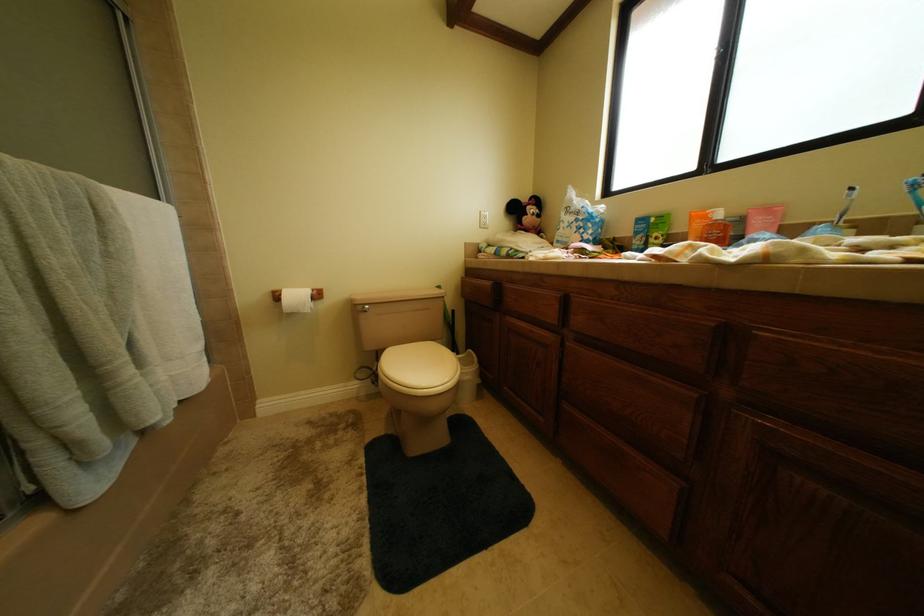
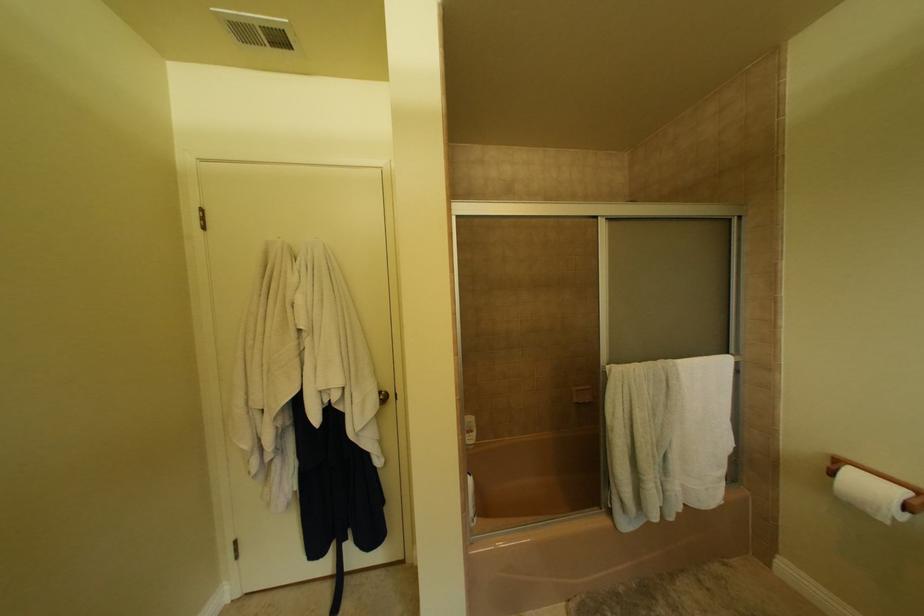
Question: The camera is either moving clockwise (left) or counter-clockwise (right) around the object. The first image is from the beginning of the video and the second image is from the end. Is the camera moving left or right when shooting the video?

Choices:
 (A) Left
 (B) Right

Answer: (B)